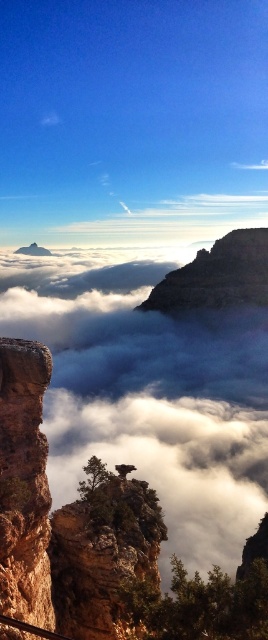
Looking at this image, who is taller, brown rough rock at center or rustic sandstone rock formation at left?

Standing taller between the two is rustic sandstone rock formation at left.

Can you confirm if brown rough rock at center is positioned to the right of rustic sandstone rock formation at left?

Indeed, brown rough rock at center is positioned on the right side of rustic sandstone rock formation at left.

I want to click on brown rough rock at center, so click(x=102, y=552).

Identify the location of brown rough rock at center. This screenshot has width=268, height=640. (102, 552).